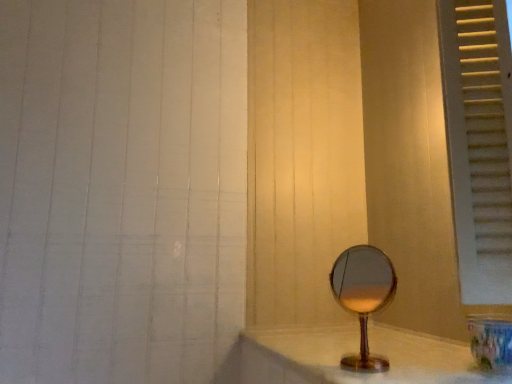
Question: Do you think translucent glass mirror at lower right is within white painted wood window frame at right, or outside of it?

Choices:
 (A) inside
 (B) outside

Answer: (B)

Question: Looking at their shapes, would you say translucent glass mirror at lower right is wider or thinner than white painted wood window frame at right?

Choices:
 (A) wide
 (B) thin

Answer: (A)

Question: Based on their relative distances, which object is nearer to the white painted wood window frame at right?

Choices:
 (A) wooden mirror at center
 (B) translucent glass mirror at lower right

Answer: (A)

Question: Estimate the real-world distances between objects in this image. Which object is farther from the wooden mirror at center?

Choices:
 (A) white painted wood window frame at right
 (B) translucent glass mirror at lower right

Answer: (A)